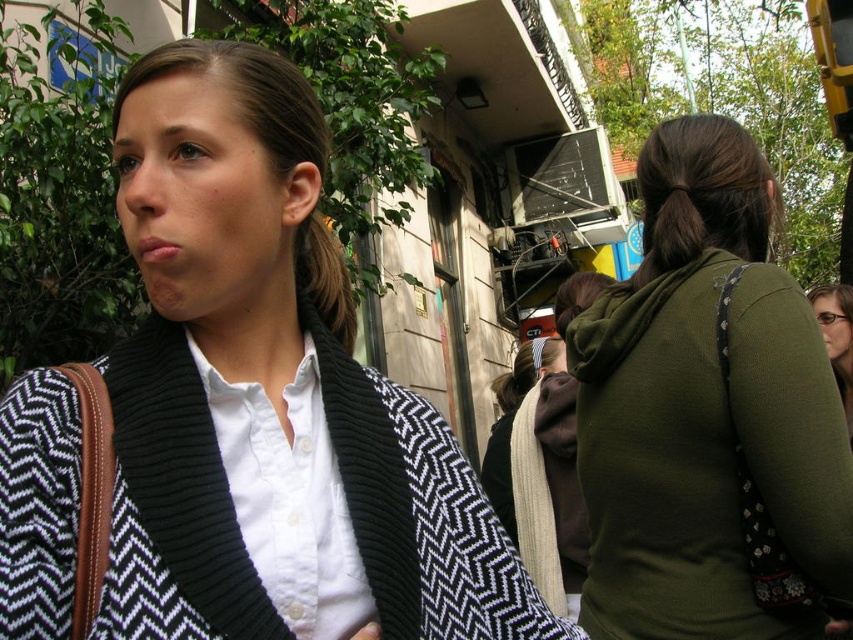
Question: Is black herringbone cardigan at center below white matte shirt at center?

Choices:
 (A) yes
 (B) no

Answer: (B)

Question: Which point appears farthest from the camera in this image?

Choices:
 (A) (4, 488)
 (B) (631, 602)
 (C) (339, 536)

Answer: (B)

Question: Does black herringbone cardigan at center have a smaller size compared to black textured sweater at upper left?

Choices:
 (A) no
 (B) yes

Answer: (A)

Question: Which point is farther to the camera?

Choices:
 (A) (227, 436)
 (B) (292, 124)
 (C) (190, 477)

Answer: (B)

Question: Does green fabric hoodie at upper right have a greater width compared to black textured sweater at upper left?

Choices:
 (A) no
 (B) yes

Answer: (B)

Question: Which point is farther to the camera?

Choices:
 (A) matte black sweater at center
 (B) black textured sweater at upper left
 (C) brown hair at upper left
 (D) green fabric hoodie at upper right

Answer: (A)